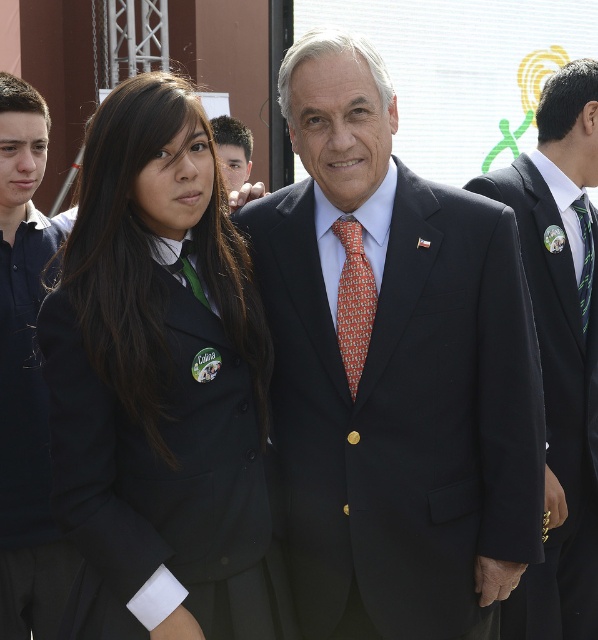
Question: Among these objects, which one is farthest from the camera?

Choices:
 (A) black fabric uniform at left
 (B) orange printed tie at center
 (C) matte black suit at left
 (D) green silk tie at center

Answer: (D)

Question: Which object is closer to the camera taking this photo?

Choices:
 (A) black fabric uniform at left
 (B) matte black suit at left
 (C) black suit at center

Answer: (A)

Question: Is black fabric uniform at left to the left of black suit at center from the viewer's perspective?

Choices:
 (A) no
 (B) yes

Answer: (B)

Question: Can you confirm if black fabric uniform at left is smaller than green silk tie at center?

Choices:
 (A) no
 (B) yes

Answer: (A)

Question: Is black fabric uniform at left below matte black suit at left?

Choices:
 (A) yes
 (B) no

Answer: (B)

Question: Which object is farther from the camera taking this photo?

Choices:
 (A) orange printed tie at center
 (B) satin black suit at center

Answer: (A)